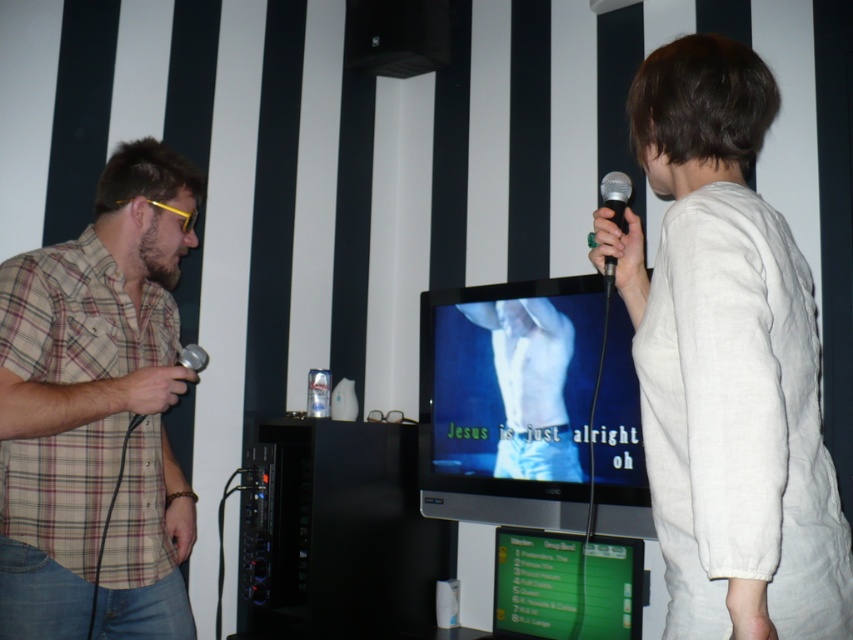
You are a photographer standing in front of the karaoke scene. You need to take a photo of both the white cotton shirt at center and the plaid cotton shirt at left. Which shirt should you focus on first if you want to capture both in the same frame without moving the camera?

The white cotton shirt at center is above the plaid cotton shirt at left, so you should focus on the plaid cotton shirt at left first since it is lower in the frame and ensure it stays within the camera frame before adjusting focus to the upper part for the white cotton shirt at center.

You are a photographer standing at the back of the room. You want to take a photo of both the man in the plaid shirt holding the microphone and the person in the white matte shirt at center. The minimum distance required for your camera to focus on both subjects clearly is 2 meters. Can you capture both subjects in focus from your current position?

The subjects are 2.17 meters apart, which is more than the 2 meter minimum distance required. Therefore, the photographer can capture both subjects in focus from their current position.